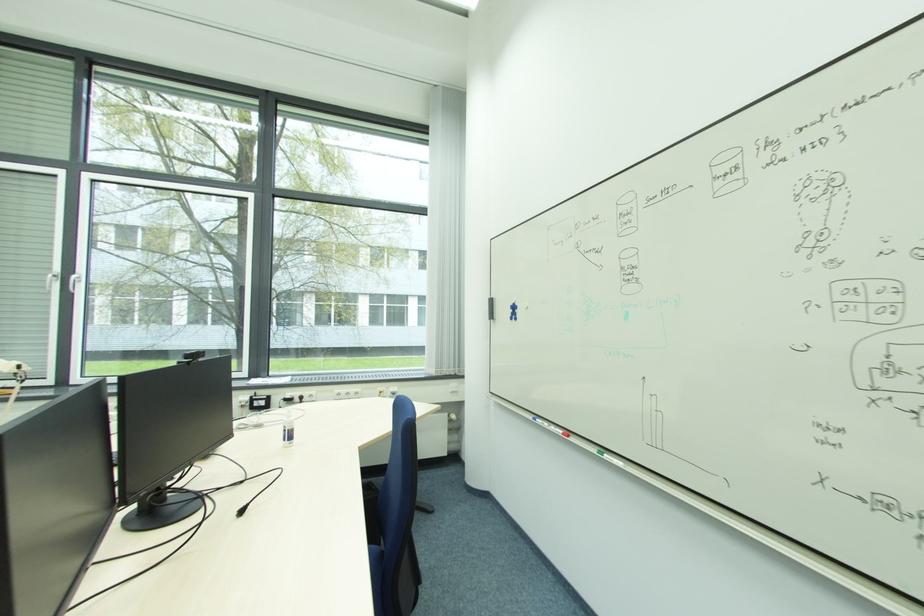
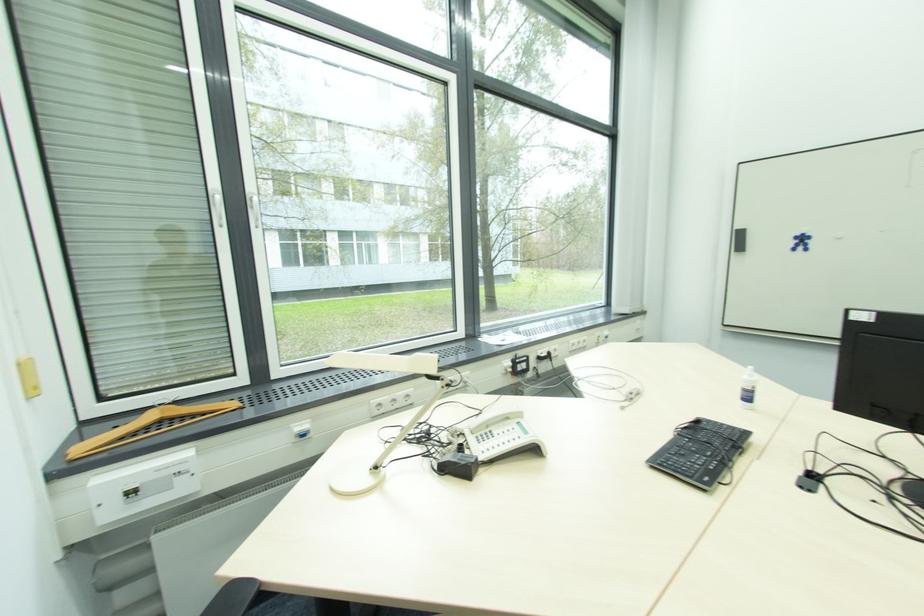
Where in the second image is the point corresponding to (515,313) from the first image?

(801, 244)